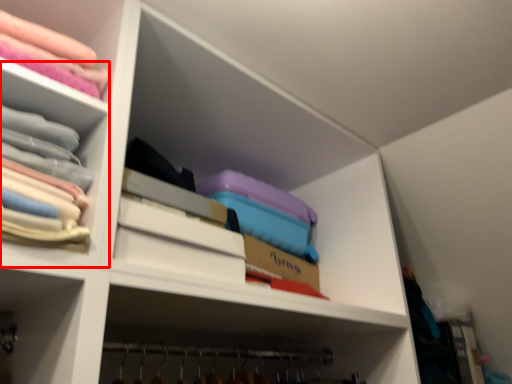
Question: Where is cabinet (annotated by the red box) located in relation to shelf in the image?

Choices:
 (A) left
 (B) right

Answer: (B)